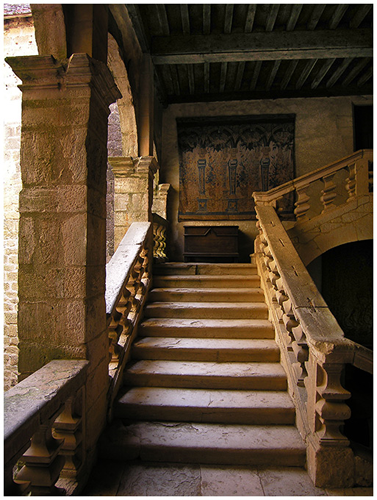
The width and height of the screenshot is (377, 500). Find the location of `pillar`. pillar is located at coordinates (63, 249), (132, 196).